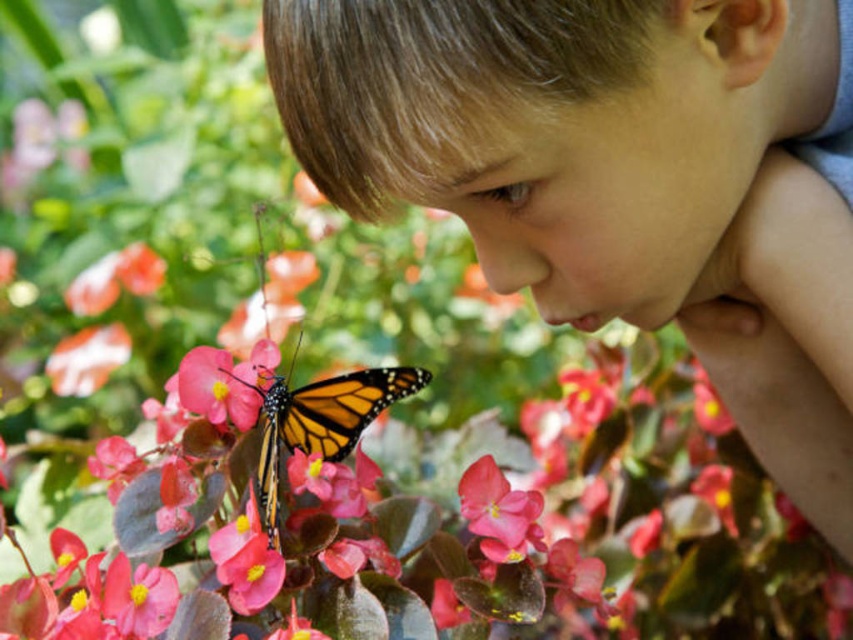
Question: Can you confirm if smooth skin child at center is positioned to the left of pink matte flower at center?

Choices:
 (A) yes
 (B) no

Answer: (B)

Question: Estimate the real-world distances between objects in this image. Which object is farther from the smooth skin child at center?

Choices:
 (A) matte pink petal at center
 (B) orange and black spotted wings at center
 (C) pink matte flower at center

Answer: (A)

Question: Which of the following is the farthest from the observer?

Choices:
 (A) (218, 397)
 (B) (524, 509)
 (C) (659, 44)
 (D) (306, 435)

Answer: (D)

Question: Does smooth pink petal at center have a lesser width compared to matte pink petal at center?

Choices:
 (A) yes
 (B) no

Answer: (A)

Question: Which point is farther from the camera taking this photo?

Choices:
 (A) (505, 193)
 (B) (376, 404)

Answer: (B)

Question: Can you confirm if orange and black spotted wings at center is positioned above matte pink petal at center?

Choices:
 (A) no
 (B) yes

Answer: (A)